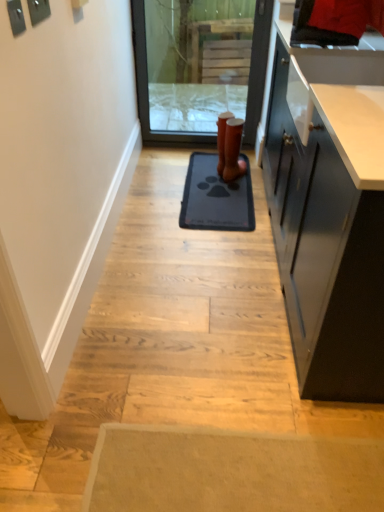
Question: Can you confirm if gray rubber mat at center is wider than transparent glass screen door at center?

Choices:
 (A) yes
 (B) no

Answer: (A)

Question: Is gray rubber mat at center to the left of transparent glass screen door at center from the viewer's perspective?

Choices:
 (A) no
 (B) yes

Answer: (A)

Question: From a real-world perspective, is gray rubber mat at center physically below transparent glass screen door at center?

Choices:
 (A) no
 (B) yes

Answer: (B)

Question: Is gray rubber mat at center at the right side of transparent glass screen door at center?

Choices:
 (A) no
 (B) yes

Answer: (B)

Question: Considering the relative sizes of gray rubber mat at center and transparent glass screen door at center in the image provided, is gray rubber mat at center taller than transparent glass screen door at center?

Choices:
 (A) no
 (B) yes

Answer: (A)

Question: Are gray rubber mat at center and transparent glass screen door at center far apart?

Choices:
 (A) no
 (B) yes

Answer: (A)

Question: Is brown leather boot at center not within gray rubber mat at center?

Choices:
 (A) no
 (B) yes

Answer: (B)

Question: Can you confirm if brown leather boot at center is thinner than gray rubber mat at center?

Choices:
 (A) no
 (B) yes

Answer: (B)

Question: From the image's perspective, is brown leather boot at center on top of gray rubber mat at center?

Choices:
 (A) yes
 (B) no

Answer: (A)

Question: Does brown leather boot at center have a smaller size compared to gray rubber mat at center?

Choices:
 (A) no
 (B) yes

Answer: (B)

Question: Can gray rubber mat at center be found inside brown leather boot at center?

Choices:
 (A) no
 (B) yes

Answer: (A)

Question: Does brown leather boot at center appear on the right side of gray rubber mat at center?

Choices:
 (A) no
 (B) yes

Answer: (B)

Question: Is gray rubber mat at center positioned in front of brown leather boot at center?

Choices:
 (A) yes
 (B) no

Answer: (A)